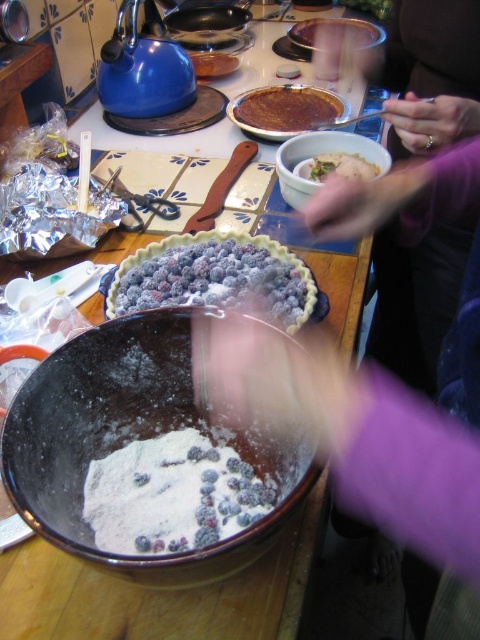
From the picture: Which is more to the left, white powdery blueberries at center or brown matte pie at center?

white powdery blueberries at center

Consider the image. Can you confirm if white powdery blueberries at center is wider than brown matte pie at center?

Incorrect, white powdery blueberries at center's width does not surpass brown matte pie at center's.

Describe the element at coordinates (171, 493) in the screenshot. This screenshot has width=480, height=640. I see `white powdery blueberries at center` at that location.

Image resolution: width=480 pixels, height=640 pixels. In order to click on white powdery blueberries at center in this screenshot , I will do `click(171, 493)`.

In the scene shown: Is brown matte pie at center taller than green leafy vegetable at upper center?

Correct, brown matte pie at center is much taller as green leafy vegetable at upper center.

Between brown matte pie at center and green leafy vegetable at upper center, which one appears on the right side from the viewer's perspective?

Positioned to the right is green leafy vegetable at upper center.

What do you see at coordinates (287, 108) in the screenshot?
I see `brown matte pie at center` at bounding box center [287, 108].

Image resolution: width=480 pixels, height=640 pixels. In order to click on brown matte pie at center in this screenshot , I will do `click(287, 108)`.

In the scene shown: Who is positioned more to the left, white powdery blueberries at center or brown crumbly pie crust at center?

Positioned to the left is white powdery blueberries at center.

Between point (215, 525) and point (361, 29), which one is positioned in front?

Positioned in front is point (215, 525).

This screenshot has width=480, height=640. I want to click on white powdery blueberries at center, so click(171, 493).